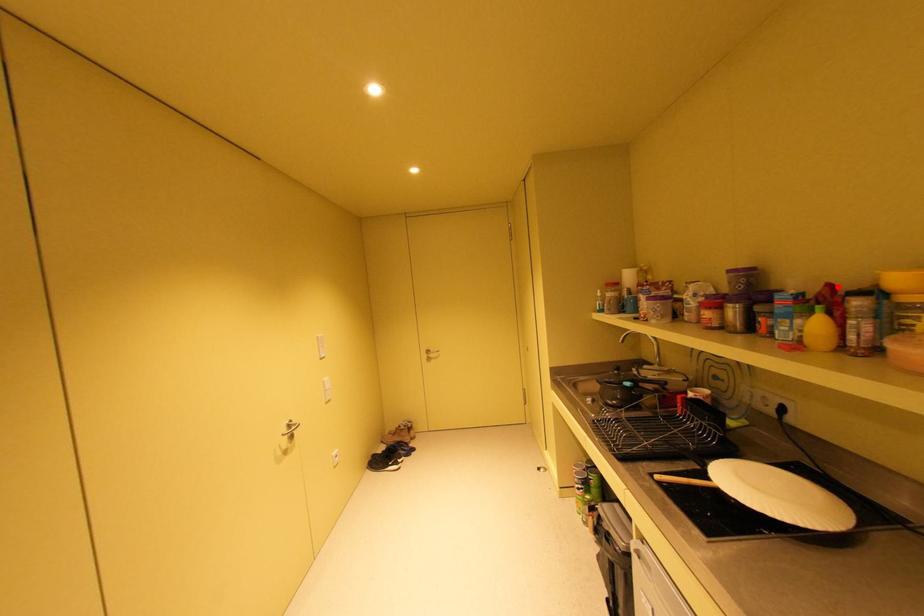
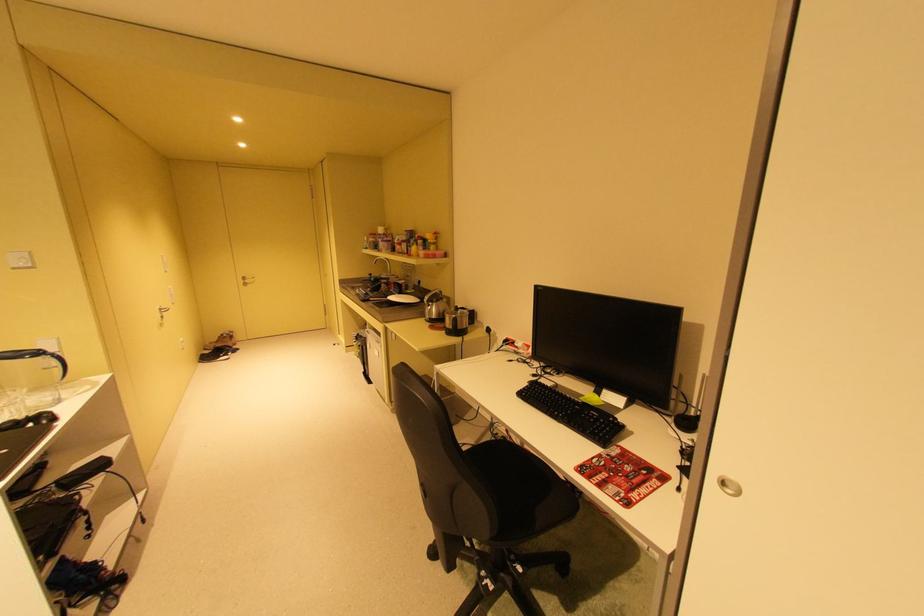
Where in the second image is the point corresponding to the highlighted location from the first image?

(428, 237)